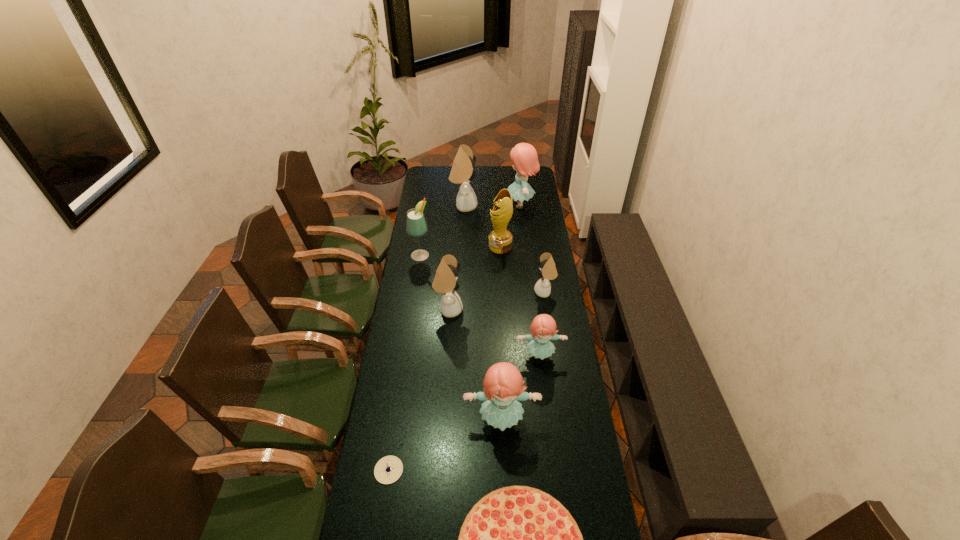
Locate an element on the screen. the biggest black doll is located at coordinates (463, 165).

At what (x,y) coordinates should I click in order to perform the action: click on the biggest blue doll. Please return your answer as a coordinate pair (x, y). Looking at the image, I should click on (524, 156).

You are a GUI agent. You are given a task and a screenshot of the screen. Output one action in this format:
    pyautogui.click(x=<x>, y=<y>)
    Task: Click on the alcohol
    This screenshot has height=540, width=960.
    Given the screenshot: What is the action you would take?
    pyautogui.click(x=416, y=226)

Where is `award`? award is located at coordinates (500, 240).

In order to click on the second smallest black doll in this screenshot , I will do (x=445, y=282).

At what (x,y) coordinates should I click in order to perform the action: click on the third nearest object. Please return your answer as a coordinate pair (x, y). Image resolution: width=960 pixels, height=540 pixels. Looking at the image, I should click on (503, 387).

This screenshot has height=540, width=960. I want to click on the nearest doll, so click(x=503, y=387).

The image size is (960, 540). I want to click on the smallest black doll, so click(x=542, y=287).

You are a GUI agent. You are given a task and a screenshot of the screen. Output one action in this format:
    pyautogui.click(x=<x>, y=<y>)
    Task: Click on the fifth farthest doll
    This screenshot has height=540, width=960.
    Given the screenshot: What is the action you would take?
    pyautogui.click(x=543, y=325)

Identify the location of the fourth nearest object. The width and height of the screenshot is (960, 540). (543, 325).